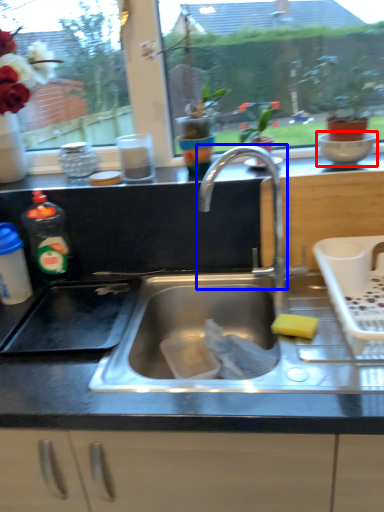
Question: Which object appears farthest to the camera in this image, mixing bowl (highlighted by a red box) or tap (highlighted by a blue box)?

Choices:
 (A) mixing bowl
 (B) tap

Answer: (A)